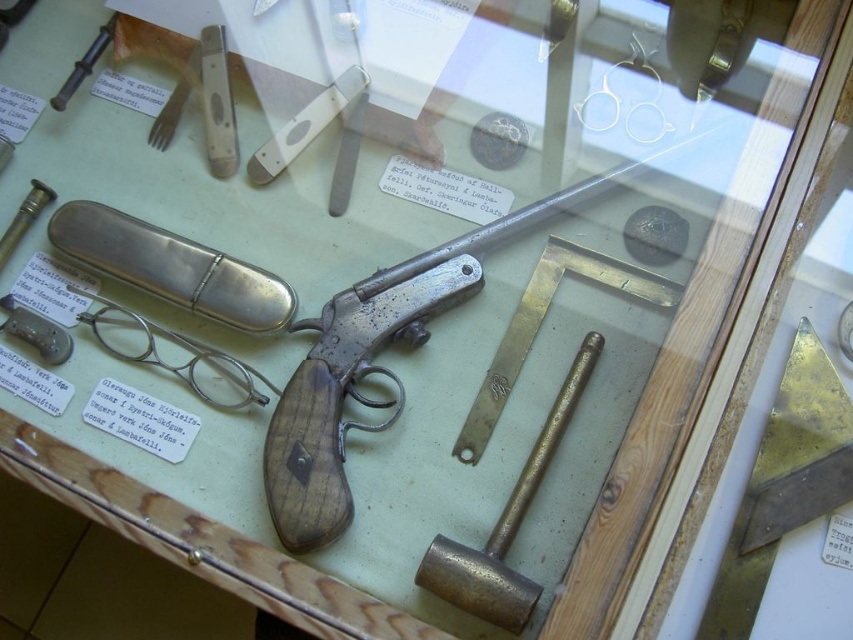
Is matte silver handgun at center smaller than matte silver bullet at left?

No.

Does matte silver handgun at center have a lesser width compared to matte silver bullet at left?

No.

Is point (421, 269) farther from viewer compared to point (12, 244)?

No, (421, 269) is in front of (12, 244).

Find the location of a particular element. Image resolution: width=853 pixels, height=640 pixels. matte silver handgun at center is located at coordinates (376, 365).

Describe the element at coordinates (506, 524) in the screenshot. I see `brass/metallic hammer at lower right` at that location.

Can you confirm if brass/metallic hammer at lower right is positioned to the right of matte silver bullet at left?

Yes, brass/metallic hammer at lower right is to the right of matte silver bullet at left.

Is point (537, 588) more distant than point (3, 264)?

No, (537, 588) is in front of (3, 264).

I want to click on brass/metallic hammer at lower right, so click(506, 524).

Between point (283, 513) and point (592, 362), which one is positioned in front?

Point (283, 513)

Based on the photo, who is more distant from viewer, (326, 344) or (494, 545)?

The point (326, 344) is more distant.

Where is `matte silver handgun at center`? This screenshot has width=853, height=640. matte silver handgun at center is located at coordinates pyautogui.click(x=376, y=365).